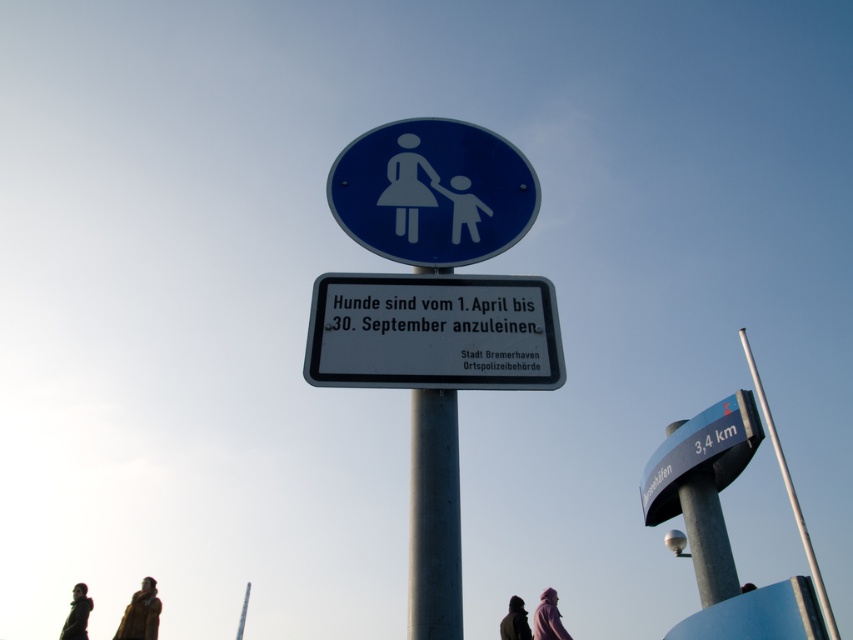
Looking at this image, you are a fashion designer observing a display of outerwear. You have a dark brown leather jacket at lower left and a dark brown fur coat at lower center. Which one is bigger in size?

The dark brown leather jacket at lower left is larger in size than the dark brown fur coat at lower center.

You are a hiker carrying a backpack and see the white plastic sign at center and the dark green jacket at lower left. Which object is wider?

The white plastic sign at center is wider than the dark green jacket at lower left.